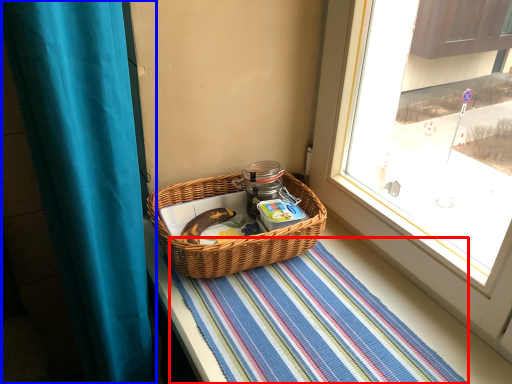
Question: Which object appears closest to the camera in this image, mat (highlighted by a red box) or curtain (highlighted by a blue box)?

Choices:
 (A) mat
 (B) curtain

Answer: (B)